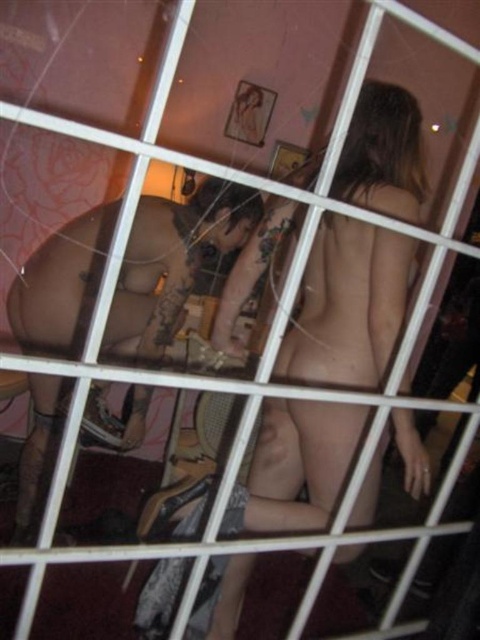
Question: Which point is farther to the camera?

Choices:
 (A) black matte underwear at lower center
 (B) smooth skin man at center

Answer: (B)

Question: Is smooth skin man at center above black matte underwear at lower center?

Choices:
 (A) yes
 (B) no

Answer: (A)

Question: Is smooth skin man at center to the left of black matte underwear at lower center from the viewer's perspective?

Choices:
 (A) no
 (B) yes

Answer: (B)

Question: Does smooth skin man at center appear on the left side of black matte underwear at lower center?

Choices:
 (A) no
 (B) yes

Answer: (B)